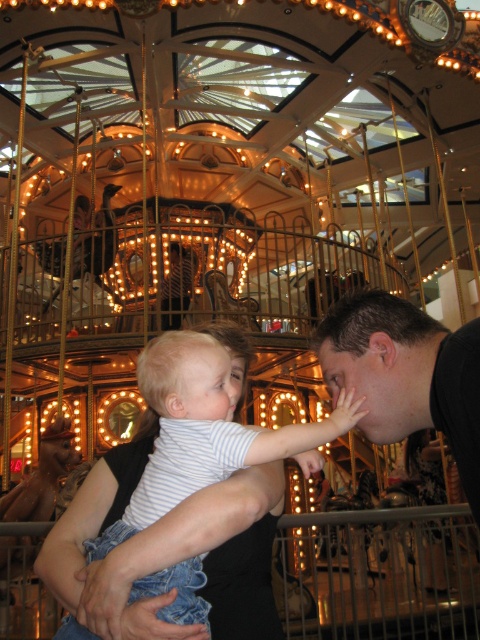
Question: Is black matte shirt at center wider than striped cotton shirt at center?

Choices:
 (A) yes
 (B) no

Answer: (B)

Question: Does black matte shirt at center have a lesser width compared to striped cotton shirt at center?

Choices:
 (A) yes
 (B) no

Answer: (A)

Question: Does black matte shirt at center have a larger size compared to striped cotton shirt at center?

Choices:
 (A) yes
 (B) no

Answer: (B)

Question: Which point is farther to the camera?

Choices:
 (A) striped cotton shirt at center
 (B) black matte shirt at center

Answer: (A)